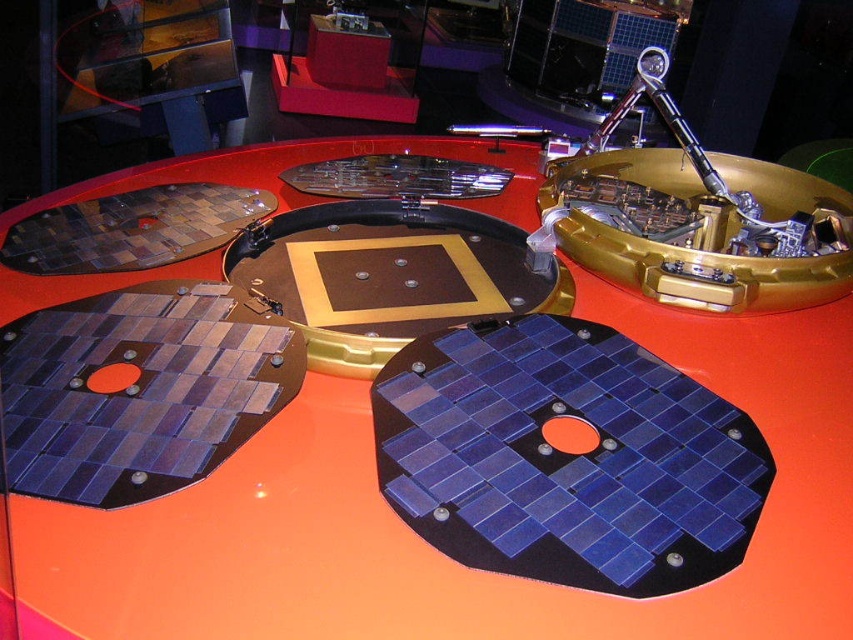
Can you confirm if blue glossy solar panel at center is positioned above gold metallic robotic arm at upper center?

No.

Which is behind, point (664, 474) or point (746, 173)?

Point (746, 173)

Who is more forward, [469,509] or [801,262]?

Positioned in front is point [469,509].

Locate an element on the screen. This screenshot has width=853, height=640. blue glossy solar panel at center is located at coordinates (566, 458).